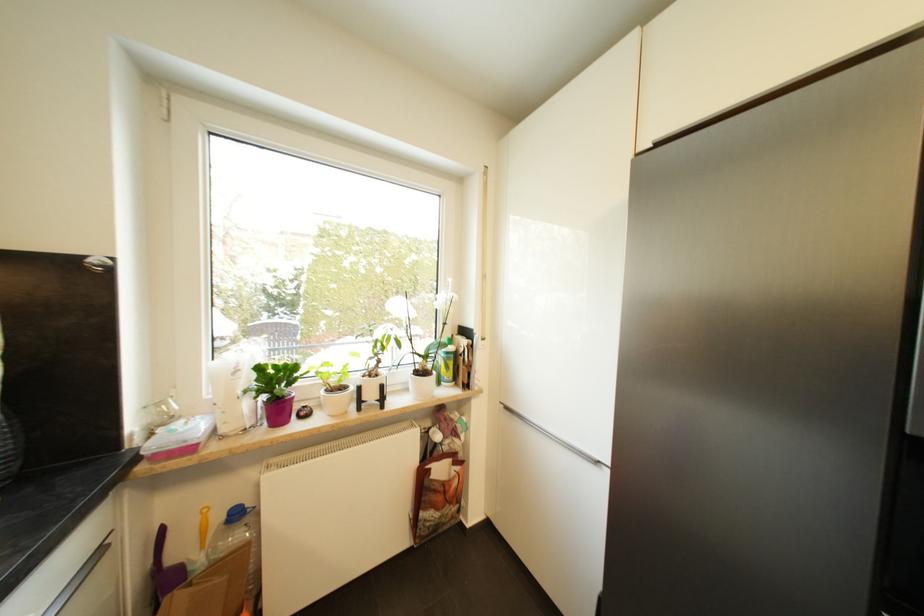
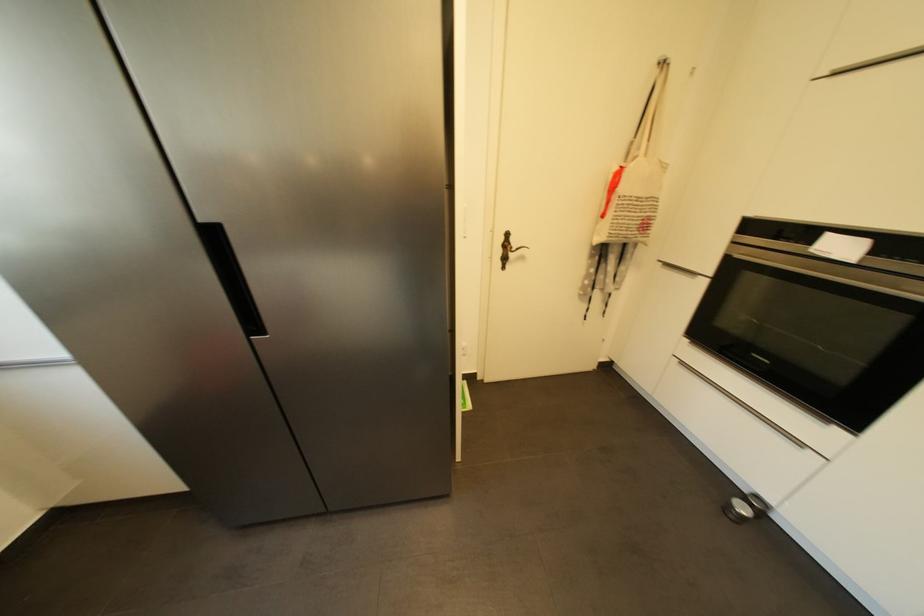
Based on the continuous images, in which direction is the camera rotating?

The camera's rotation is toward right-down.